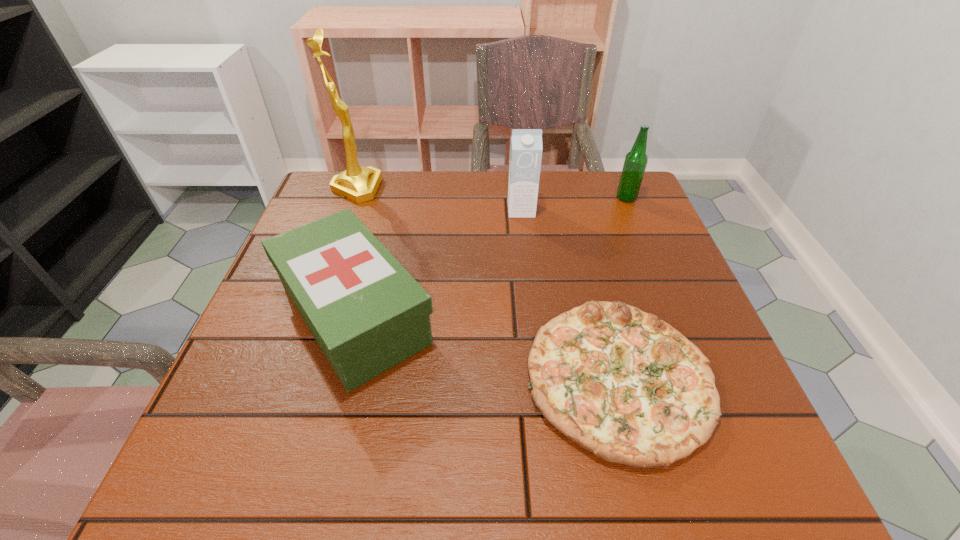
Identify the location of the tallest object. (359, 184).

You are a GUI agent. You are given a task and a screenshot of the screen. Output one action in this format:
    pyautogui.click(x=<x>, y=<y>)
    Task: Click on the carton
    
    Given the screenshot: What is the action you would take?
    click(x=526, y=148)

Find the location of a particular element. The width and height of the screenshot is (960, 540). beer bottle is located at coordinates point(636,160).

This screenshot has height=540, width=960. Identify the location of the fourth tallest object. (367, 313).

Identify the location of pizza. (629, 388).

Image resolution: width=960 pixels, height=540 pixels. I want to click on free space located on the front-facing side of the tallest object, so click(477, 188).

Identify the location of vacant area located on the front label of the carton. The width and height of the screenshot is (960, 540). (528, 272).

The height and width of the screenshot is (540, 960). What are the coordinates of `free space located 0.290m on the label of the beer bottle` in the screenshot? It's located at (509, 198).

I want to click on free spot located 0.250m on the label of the beer bottle, so click(x=523, y=198).

Where is `vacant area situated on the label of the beer bottle`? The height and width of the screenshot is (540, 960). vacant area situated on the label of the beer bottle is located at coordinates (545, 198).